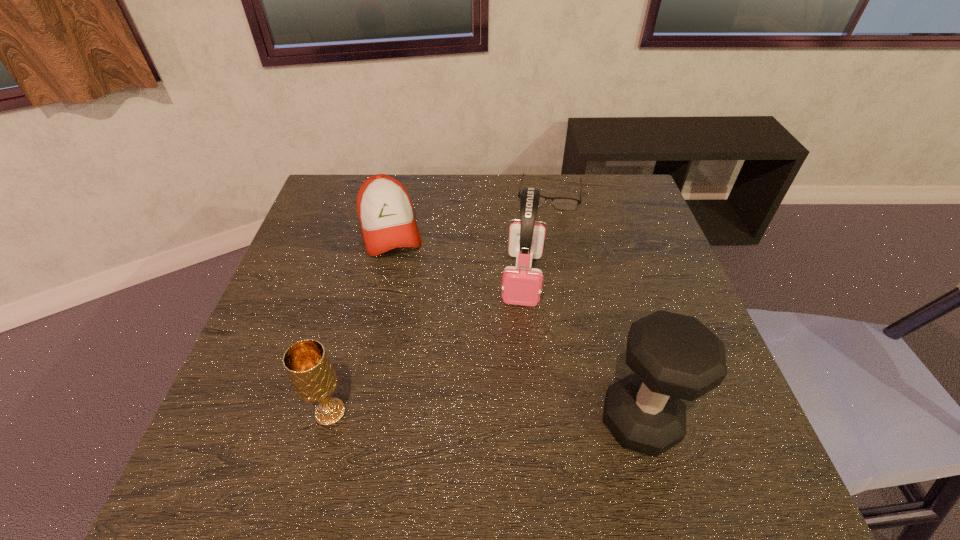
Where is `vacant space located on the front-facing side of the baseball cap`? Image resolution: width=960 pixels, height=540 pixels. vacant space located on the front-facing side of the baseball cap is located at coordinates (425, 368).

This screenshot has height=540, width=960. Find the location of `vacant region located 0.160m on the front-facing side of the baseball cap`. vacant region located 0.160m on the front-facing side of the baseball cap is located at coordinates [x=407, y=304].

Where is `vacant space situated 0.310m on the front-facing side of the baseball cap`? vacant space situated 0.310m on the front-facing side of the baseball cap is located at coordinates (420, 353).

Where is `vacant space located on the front-facing side of the spectacles`? The height and width of the screenshot is (540, 960). vacant space located on the front-facing side of the spectacles is located at coordinates (536, 303).

Locate an element on the screen. Image resolution: width=960 pixels, height=540 pixels. vacant position located 0.230m on the front-facing side of the spectacles is located at coordinates (540, 264).

The width and height of the screenshot is (960, 540). In order to click on free space located 0.230m on the front-facing side of the spectacles in this screenshot , I will do `click(540, 264)`.

Image resolution: width=960 pixels, height=540 pixels. I want to click on baseball cap present at the far edge, so click(385, 212).

Image resolution: width=960 pixels, height=540 pixels. I want to click on spectacles present at the far edge, so click(x=561, y=203).

Locate an element on the screen. The height and width of the screenshot is (540, 960). chalice located in the near edge section of the desktop is located at coordinates (307, 364).

Find the location of a particular element. This screenshot has width=960, height=540. dumbbell at the near edge is located at coordinates point(674,356).